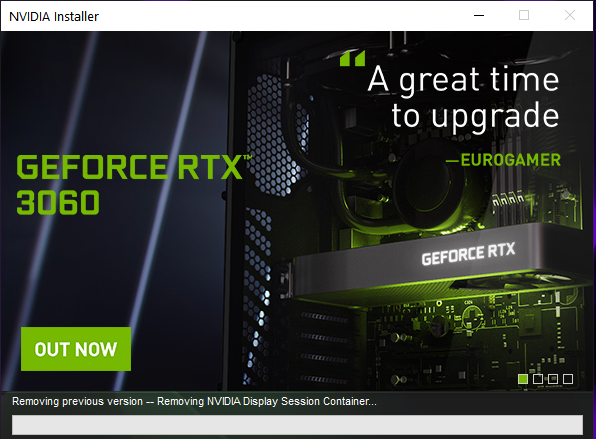
I want to click on computer case, so click(296, 230).